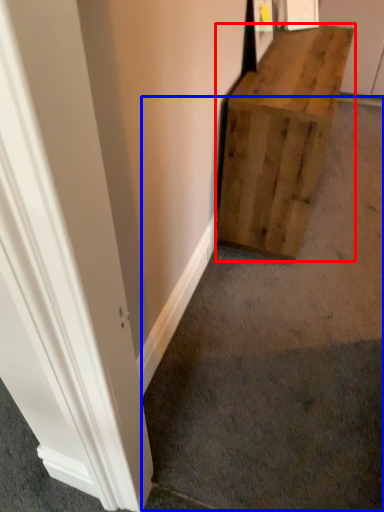
Question: Among these objects, which one is nearest to the camera, furniture (highlighted by a red box) or concrete (highlighted by a blue box)?

Choices:
 (A) furniture
 (B) concrete

Answer: (B)